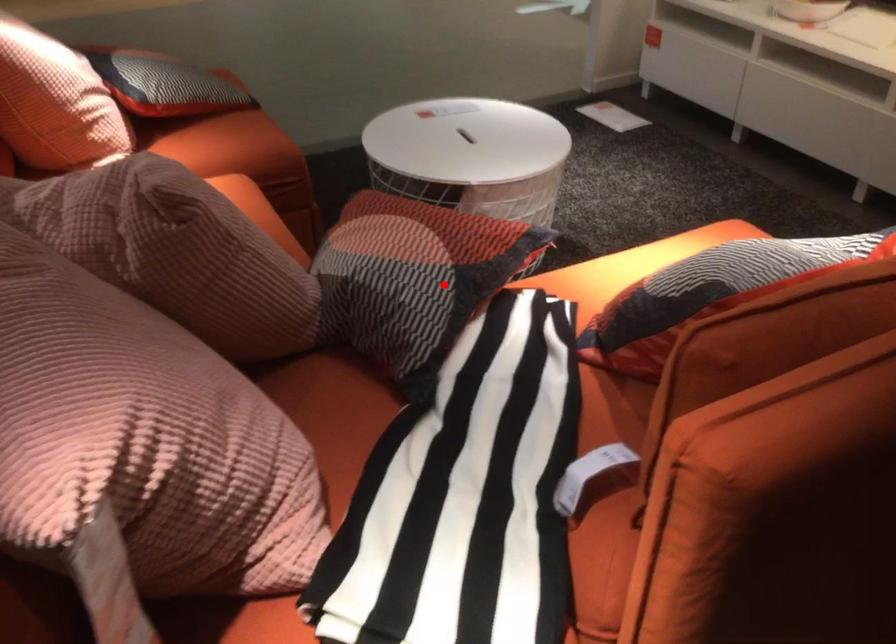
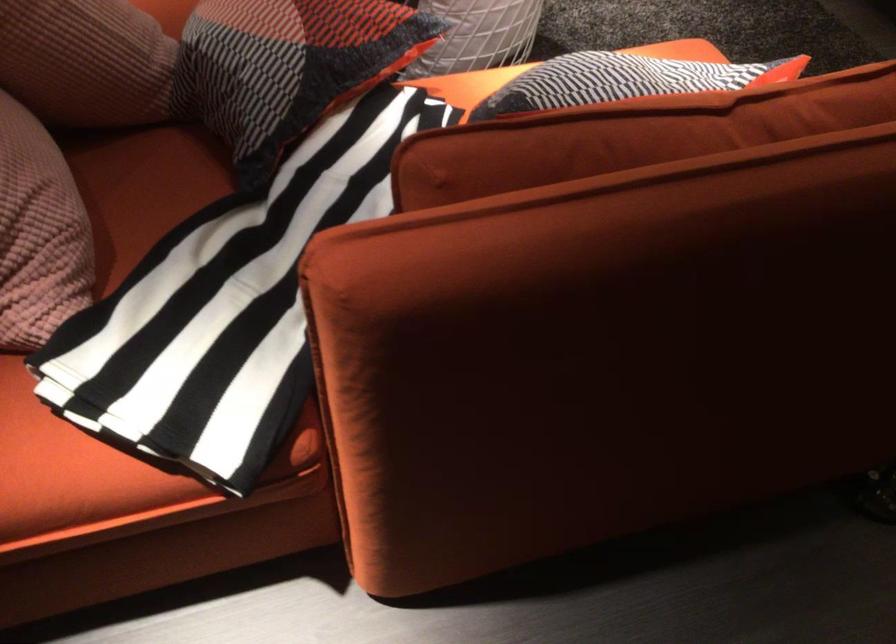
Locate, in the second image, the point that corresponds to the highlighted location in the first image.

(288, 67)